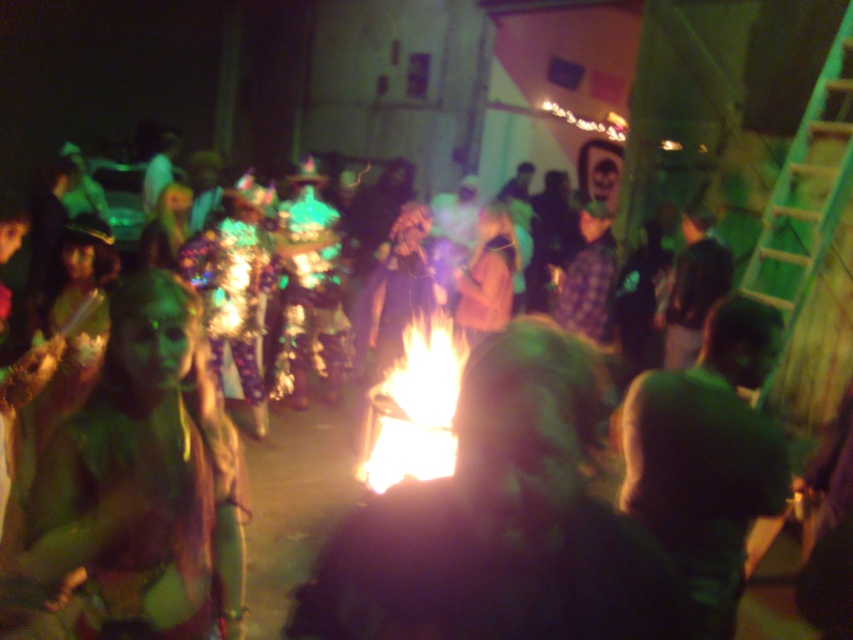
Question: Is green matte shirt at right thinner than bright orange flames at center?

Choices:
 (A) no
 (B) yes

Answer: (B)

Question: Which object appears closest to the camera in this image?

Choices:
 (A) bright orange flames at center
 (B) green matte shirt at right

Answer: (B)

Question: Can you confirm if green matte shirt at right is bigger than bright orange flames at center?

Choices:
 (A) no
 (B) yes

Answer: (A)

Question: Which object appears farthest from the camera in this image?

Choices:
 (A) bright orange flames at center
 (B) green matte shirt at right

Answer: (A)

Question: Can you confirm if green matte shirt at right is positioned above bright orange flames at center?

Choices:
 (A) no
 (B) yes

Answer: (A)